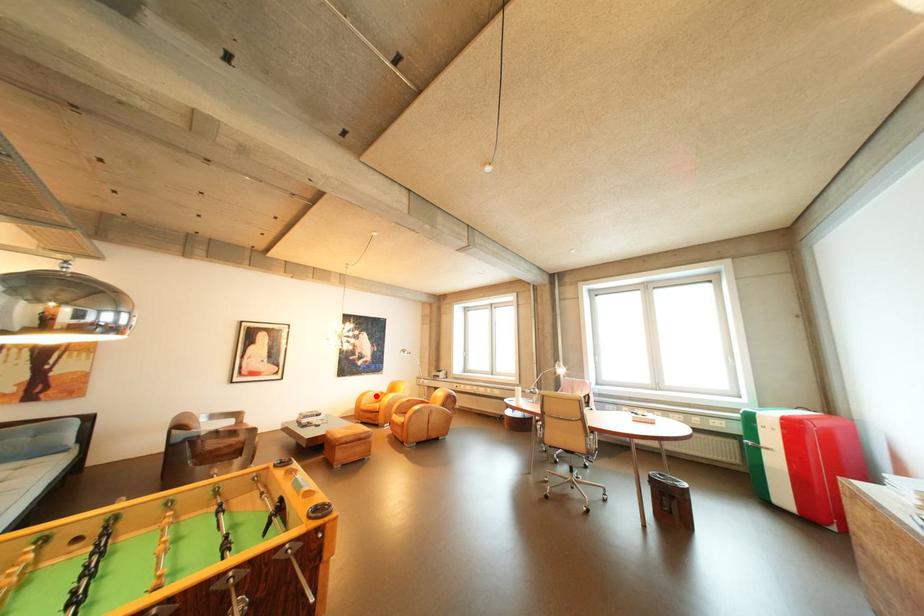
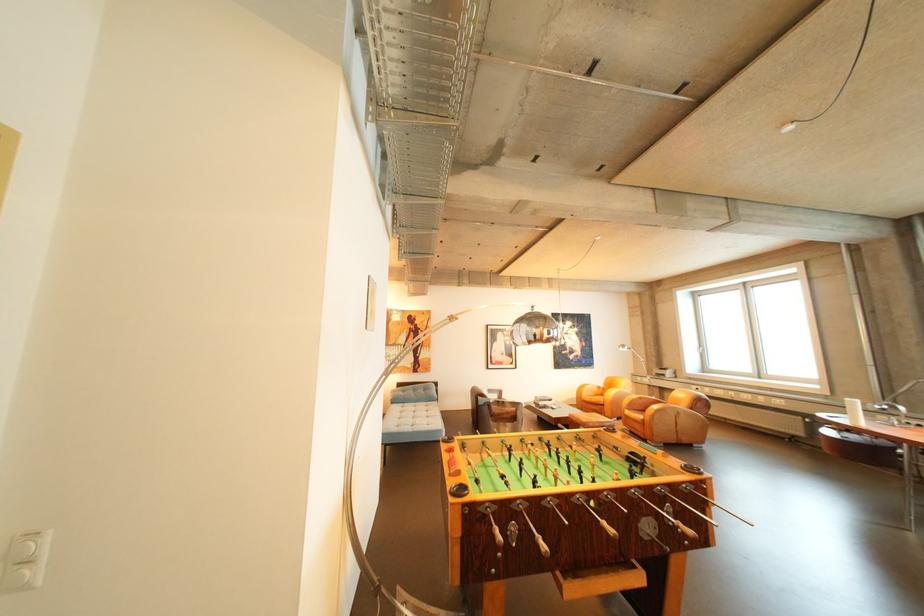
Question: A red point is marked in image1. In image2, is the corresponding 3D point closer to the camera or farther? Reply with the corresponding letter.

Choices:
 (A) The corresponding 3D point is closer.
 (B) The corresponding 3D point is farther.

Answer: (B)